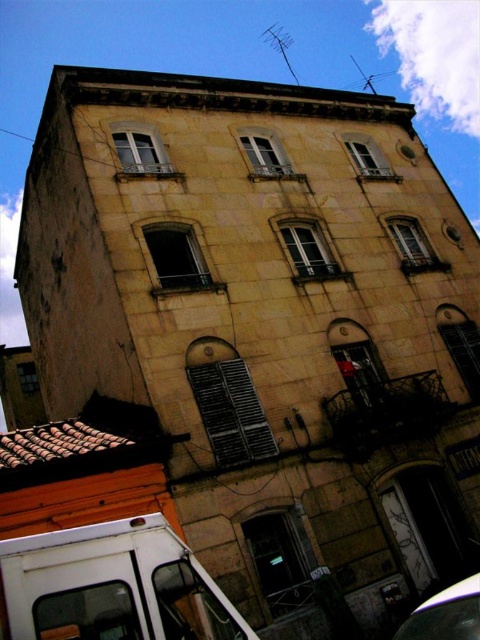
Does point (151, 570) come farther from viewer compared to point (429, 604)?

That is False.

The image size is (480, 640). Describe the element at coordinates (112, 586) in the screenshot. I see `white matte van at lower left` at that location.

Does point (24, 600) lie behind point (457, 589)?

No, it is in front of (457, 589).

Locate an element on the screen. The height and width of the screenshot is (640, 480). white matte van at lower left is located at coordinates (112, 586).